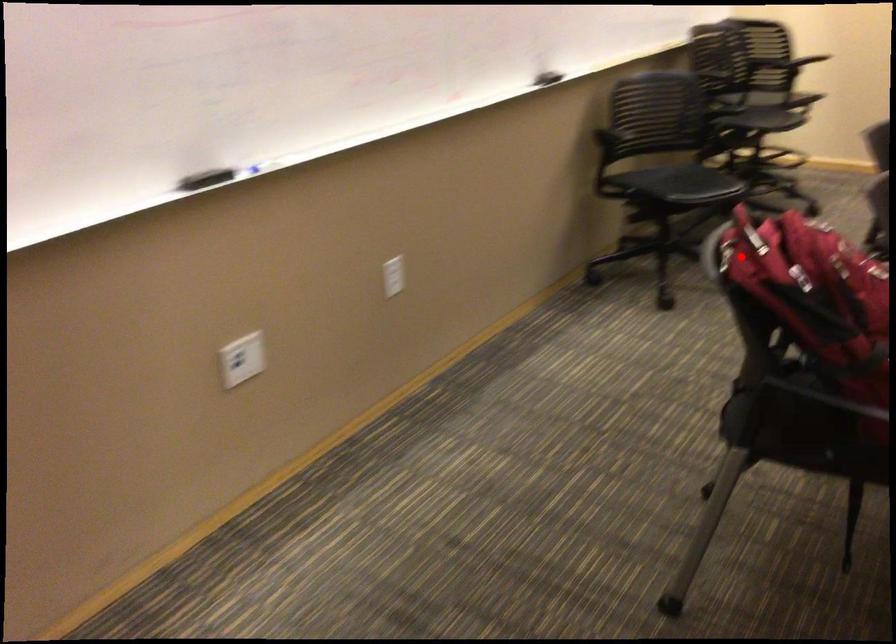
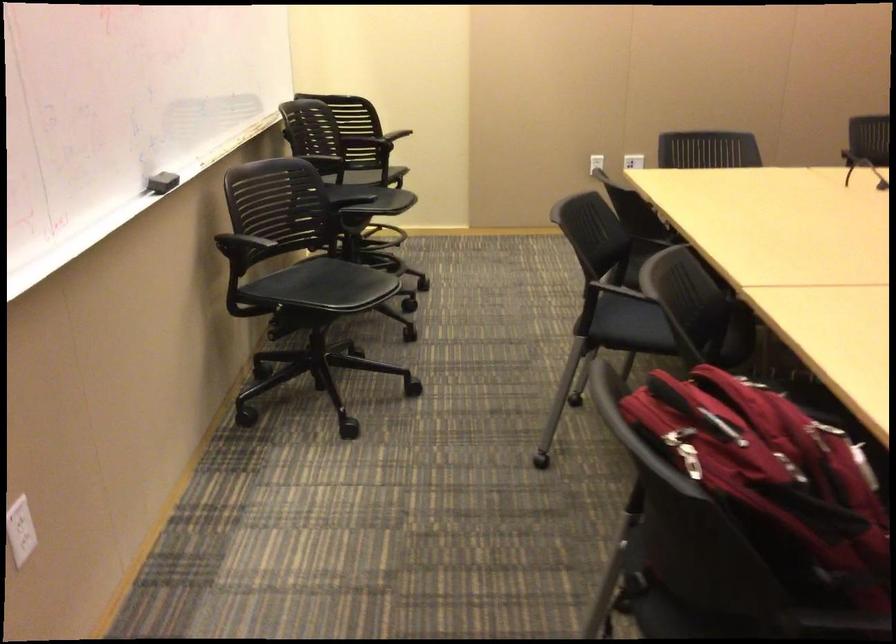
Question: I am providing you with two images of the same scene from different viewpoints. Given a red point in image1, look at the same physical point in image2. Is it:

Choices:
 (A) Closer to the viewpoint
 (B) Farther from the viewpoint

Answer: (A)